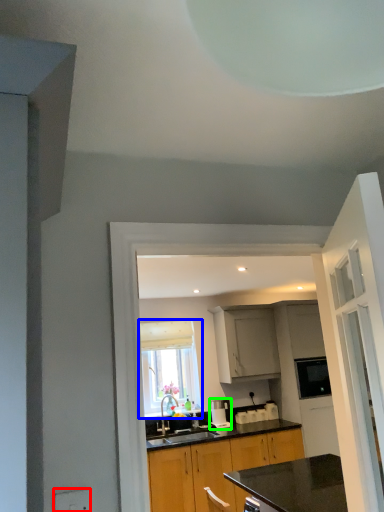
Question: Based on their relative distances, which object is farther from electric outlet (highlighted by a red box)? Choose from window (highlighted by a blue box) and coffee machine (highlighted by a green box).

Choices:
 (A) window
 (B) coffee machine

Answer: (A)